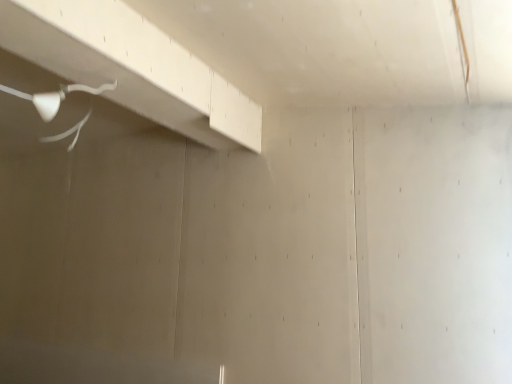
Where is `white matte shelf at upper left`? This screenshot has width=512, height=384. white matte shelf at upper left is located at coordinates (132, 66).

What do you see at coordinates (132, 66) in the screenshot? This screenshot has height=384, width=512. I see `white matte shelf at upper left` at bounding box center [132, 66].

Locate an element on the screen. Image resolution: width=512 pixels, height=384 pixels. white matte shelf at upper left is located at coordinates (132, 66).